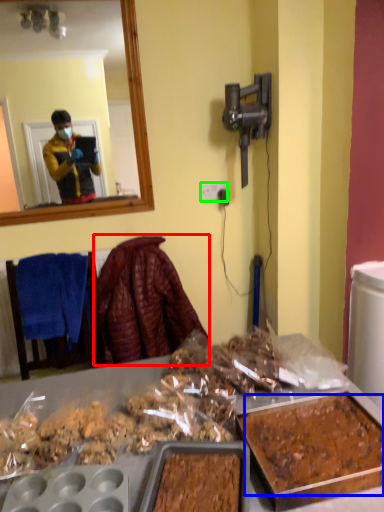
Question: Based on their relative distances, which object is nearer to blanket (highlighted by a red box)? Choose from food (highlighted by a blue box) and power outlet (highlighted by a green box).

Choices:
 (A) food
 (B) power outlet

Answer: (B)